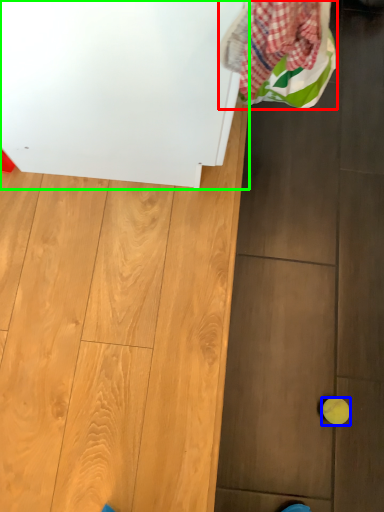
Question: Based on their relative distances, which object is farther from laundry (highlighted by a red box)? Choose from ball (highlighted by a blue box) and appliance (highlighted by a green box).

Choices:
 (A) ball
 (B) appliance

Answer: (A)